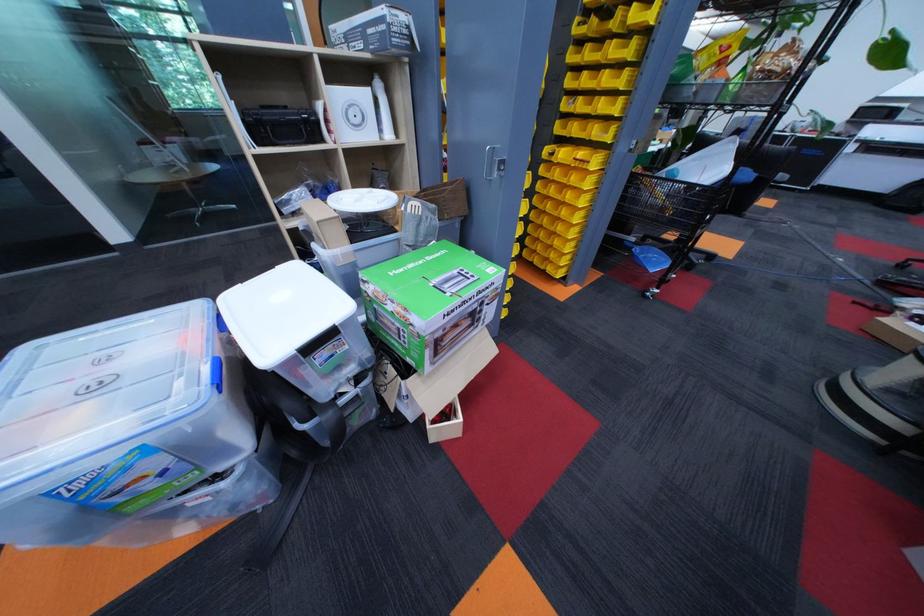
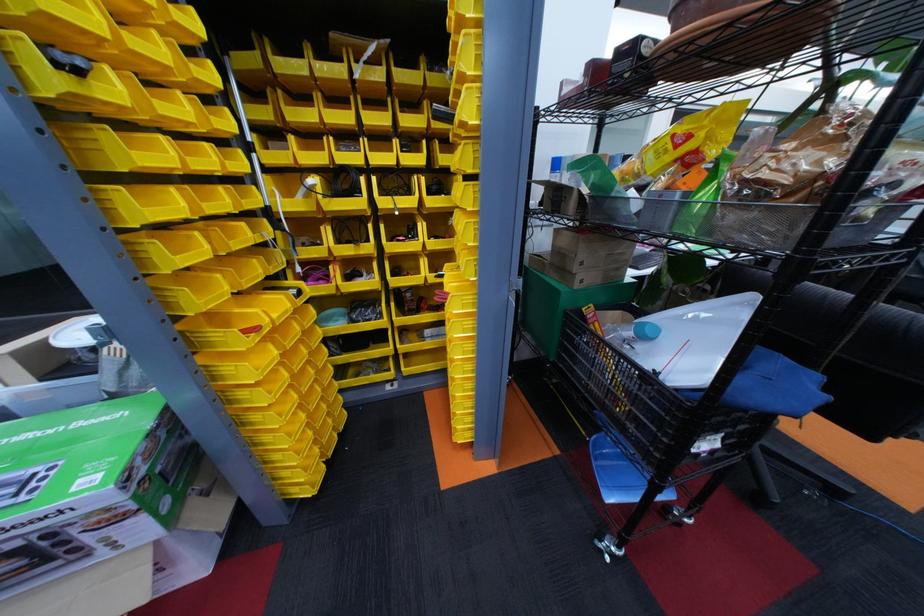
Locate, in the second image, the point that corresponds to (x=704, y=188) in the first image.

(662, 378)